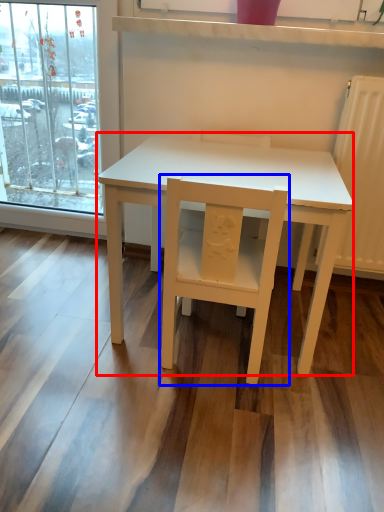
Question: Which point is closer to the camera, table (highlighted by a red box) or chair (highlighted by a blue box)?

Choices:
 (A) table
 (B) chair

Answer: (B)